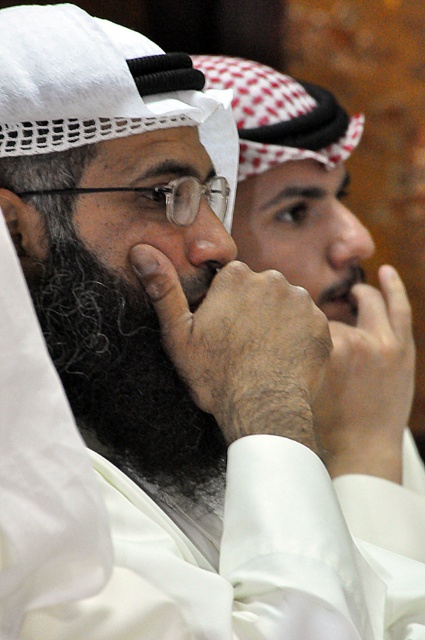
Question: Is curly dark brown beard at center to the left of white matte hand at center from the viewer's perspective?

Choices:
 (A) no
 (B) yes

Answer: (B)

Question: Which object is farther from the camera taking this photo?

Choices:
 (A) white matte hand at center
 (B) curly dark brown beard at center
 (C) matte white nose at center

Answer: (A)

Question: Can you confirm if matte white nose at center is positioned to the right of matte black beard at center?

Choices:
 (A) yes
 (B) no

Answer: (B)

Question: Which point is farther to the camera?

Choices:
 (A) matte white nose at center
 (B) matte black beard at center
 (C) white matte hand at center
 (D) dry skin/hairy hand at center

Answer: (B)

Question: Which object is closer to the camera taking this photo?

Choices:
 (A) dry skin/hairy hand at center
 (B) curly dark brown beard at center
 (C) white matte hand at center
 (D) matte white nose at center

Answer: (A)

Question: Does dry skin/hairy hand at center appear under matte white nose at center?

Choices:
 (A) no
 (B) yes

Answer: (B)